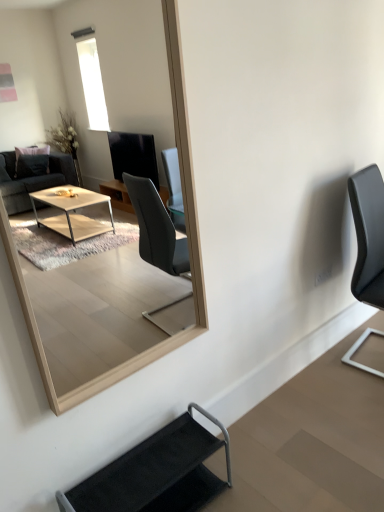
Question: Is black fabric chair at lower center, the first chair from the front, bigger than black leather chair at right, acting as the first chair starting from the top?

Choices:
 (A) yes
 (B) no

Answer: (B)

Question: Is black fabric chair at lower center, acting as the 1th chair starting from the left, turned away from black leather chair at right, marked as the 1th chair in a right-to-left arrangement?

Choices:
 (A) yes
 (B) no

Answer: (B)

Question: Is black fabric chair at lower center, acting as the 1th chair starting from the left, aimed at black leather chair at right, the 2th chair viewed from the front?

Choices:
 (A) no
 (B) yes

Answer: (A)

Question: Does black fabric chair at lower center, which ranks as the first chair in bottom-to-top order, come in front of black leather chair at right, the 1th chair positioned from the back?

Choices:
 (A) no
 (B) yes

Answer: (B)

Question: Considering the relative sizes of black fabric chair at lower center, which ranks as the first chair in bottom-to-top order, and black leather chair at right, which is the 2th chair in bottom-to-top order, in the image provided, is black fabric chair at lower center, which ranks as the first chair in bottom-to-top order, taller than black leather chair at right, which is the 2th chair in bottom-to-top order,?

Choices:
 (A) no
 (B) yes

Answer: (A)

Question: Considering the relative sizes of black fabric chair at lower center, marked as the second chair in a right-to-left arrangement, and black leather chair at right, which is the 2th chair in bottom-to-top order, in the image provided, is black fabric chair at lower center, marked as the second chair in a right-to-left arrangement, shorter than black leather chair at right, which is the 2th chair in bottom-to-top order,?

Choices:
 (A) yes
 (B) no

Answer: (A)

Question: Could you tell me if black fabric chair at lower center, the 2th chair positioned from the top, is facing light wood mirror at upper center?

Choices:
 (A) no
 (B) yes

Answer: (A)

Question: Considering the relative sizes of black fabric chair at lower center, the 2th chair positioned from the top, and light wood mirror at upper center in the image provided, is black fabric chair at lower center, the 2th chair positioned from the top, taller than light wood mirror at upper center?

Choices:
 (A) no
 (B) yes

Answer: (A)

Question: Is black fabric chair at lower center, acting as the 1th chair starting from the left, thinner than light wood mirror at upper center?

Choices:
 (A) no
 (B) yes

Answer: (A)

Question: From a real-world perspective, is black fabric chair at lower center, acting as the 1th chair starting from the left, positioned under light wood mirror at upper center based on gravity?

Choices:
 (A) no
 (B) yes

Answer: (B)

Question: Considering the relative sizes of black fabric chair at lower center, the first chair from the front, and light wood mirror at upper center in the image provided, is black fabric chair at lower center, the first chair from the front, wider than light wood mirror at upper center?

Choices:
 (A) no
 (B) yes

Answer: (B)

Question: Is black fabric chair at lower center, acting as the 1th chair starting from the left, to the left of light wood mirror at upper center from the viewer's perspective?

Choices:
 (A) no
 (B) yes

Answer: (A)

Question: Is black leather chair at right, the 2th chair viewed from the front, to the left of black fabric chair at lower center, marked as the second chair in a right-to-left arrangement, from the viewer's perspective?

Choices:
 (A) no
 (B) yes

Answer: (A)